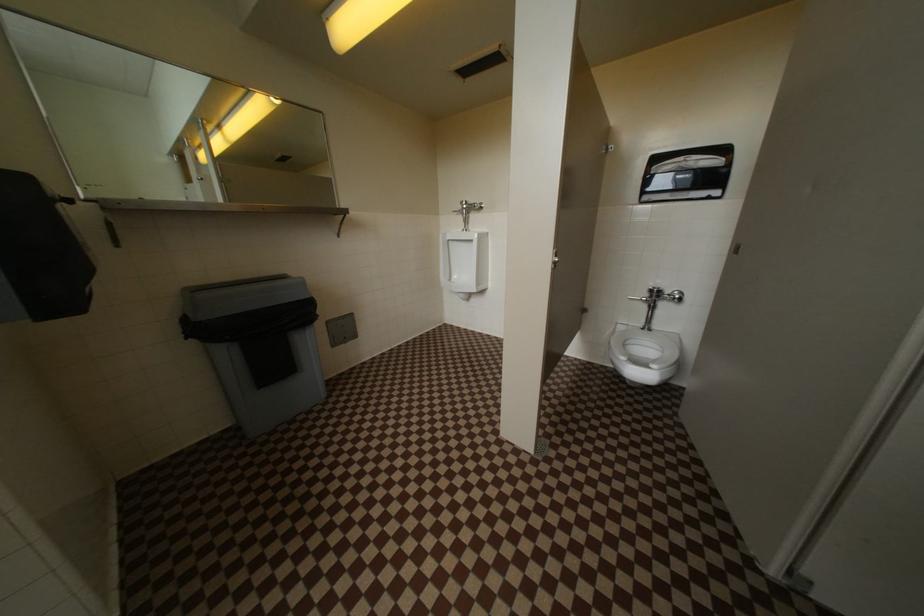
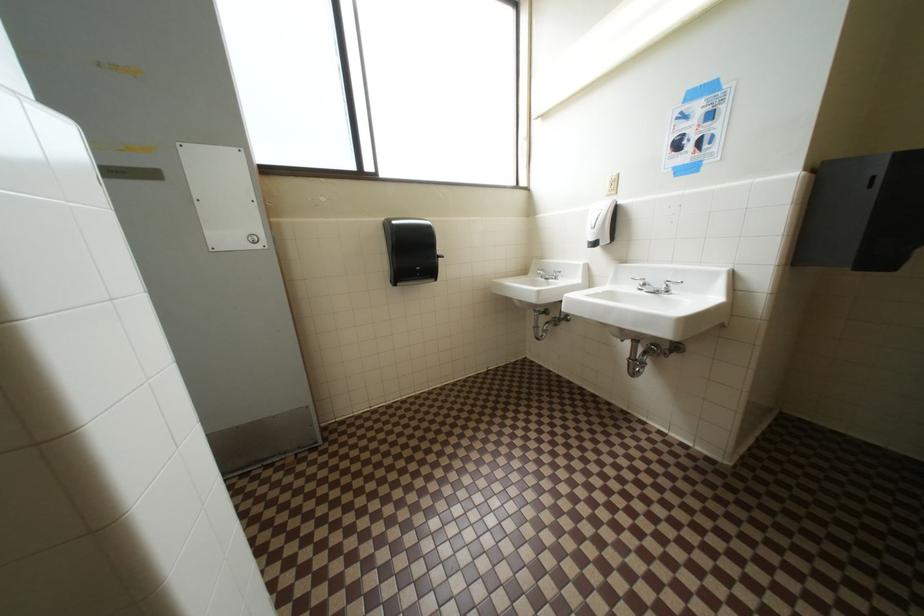
Based on the continuous images, in which direction is the camera rotating?

The camera rotated toward left-down.